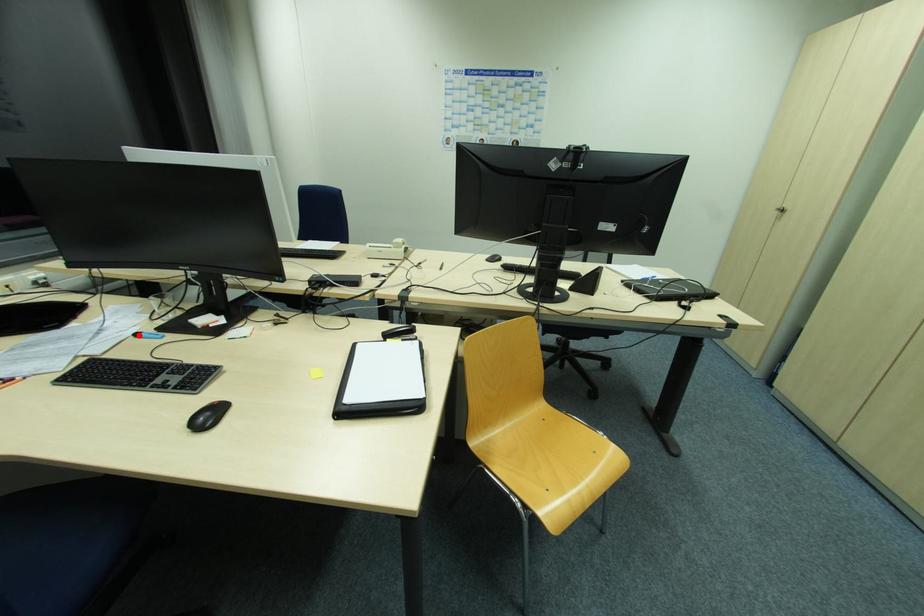
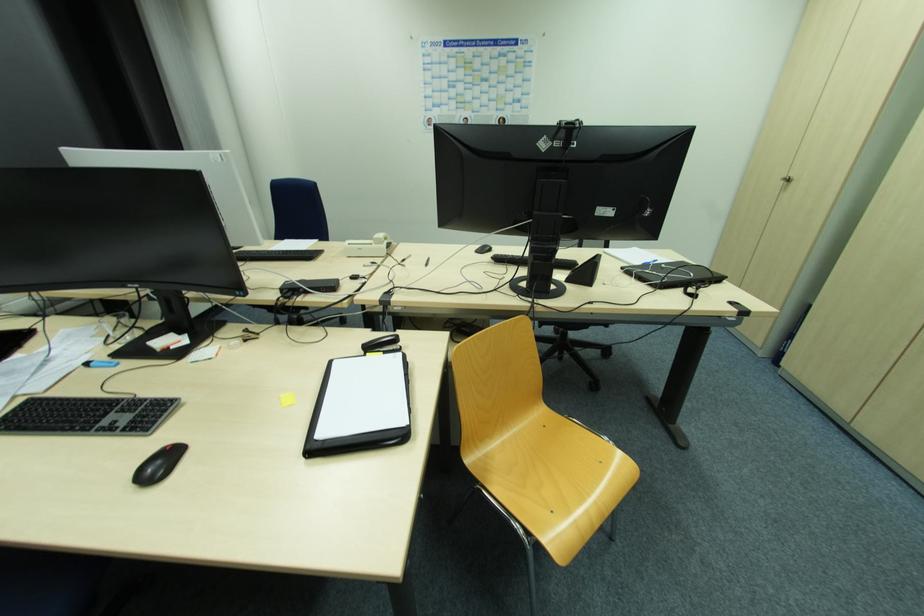
In the second image, find the point that corresponds to the highlighted location in the first image.

(90, 365)